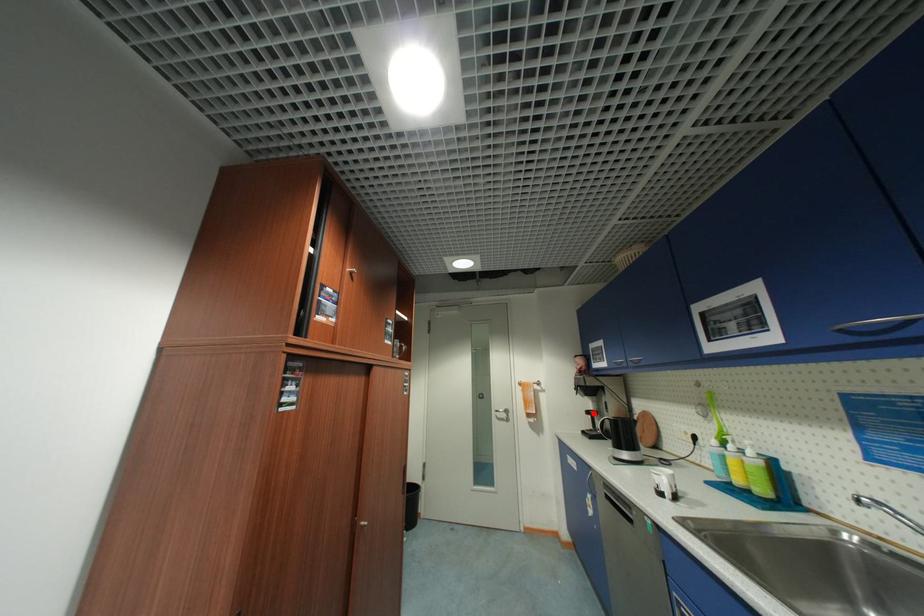
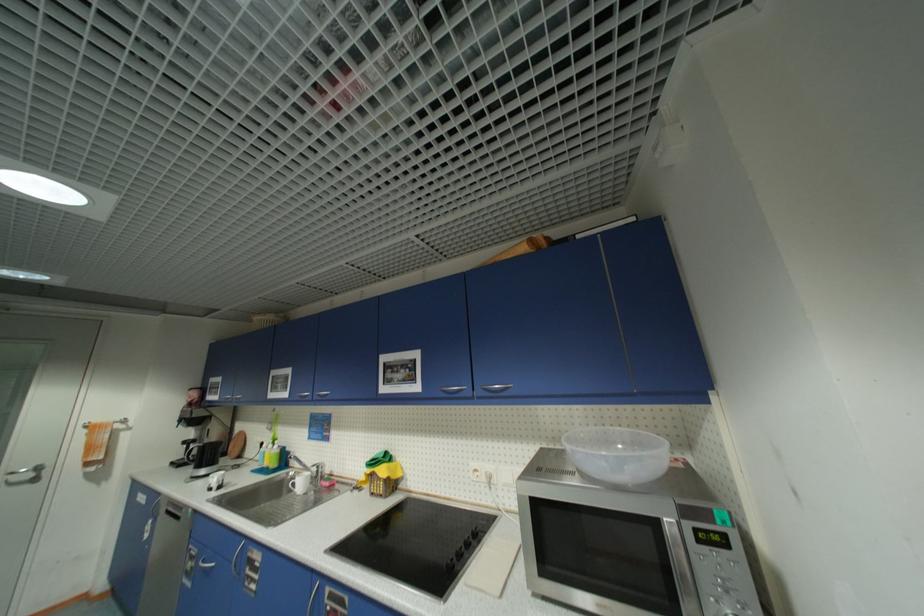
Question: I am providing you with two images of the same scene from different viewpoints. In image1, a red point is highlighted. Considering the same 3D point in image2, which of the following is correct?

Choices:
 (A) It is closer
 (B) It is farther

Answer: (A)